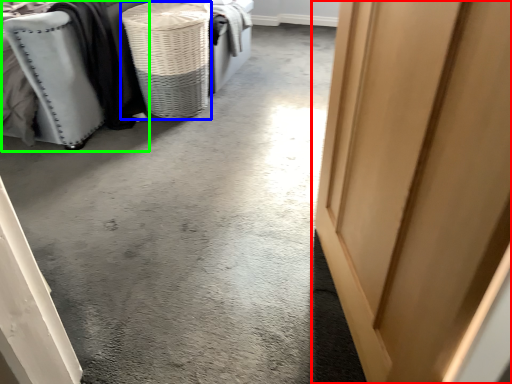
Question: Based on their relative distances, which object is farther from door (highlighted by a red box)? Choose from basket (highlighted by a blue box) and furniture (highlighted by a green box).

Choices:
 (A) basket
 (B) furniture

Answer: (B)